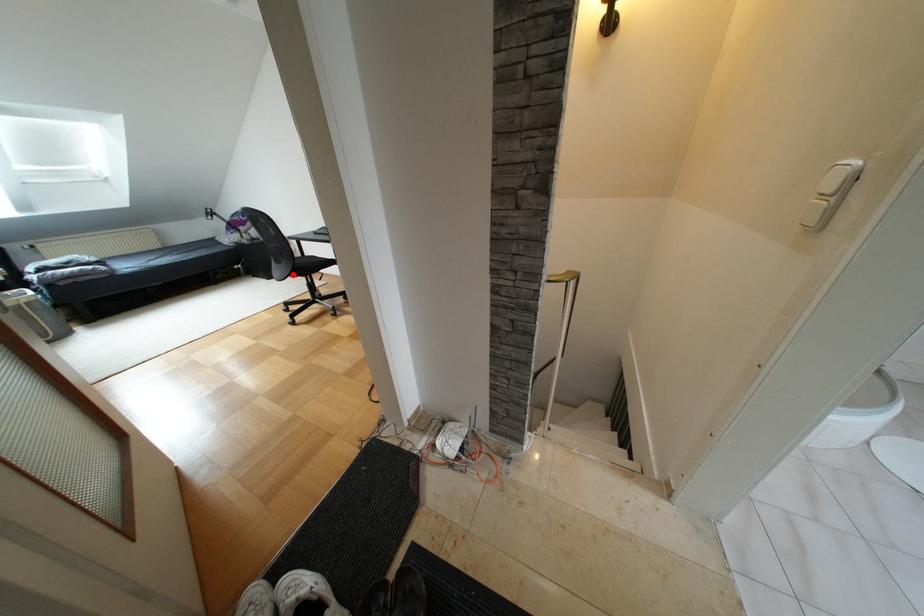
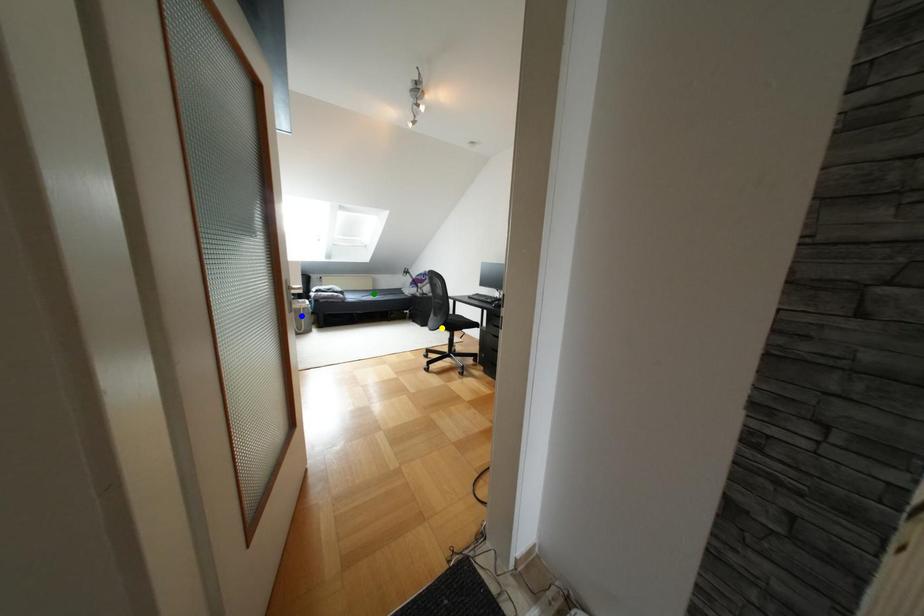
Question: I am providing you with two images of the same scene from different viewpoints. A red point is marked on the first image. You are given multiple points on the second image. Which point in image 2 is actually the same real-world point as the red point in image 1?

Choices:
 (A) green point
 (B) blue point
 (C) yellow point

Answer: (C)